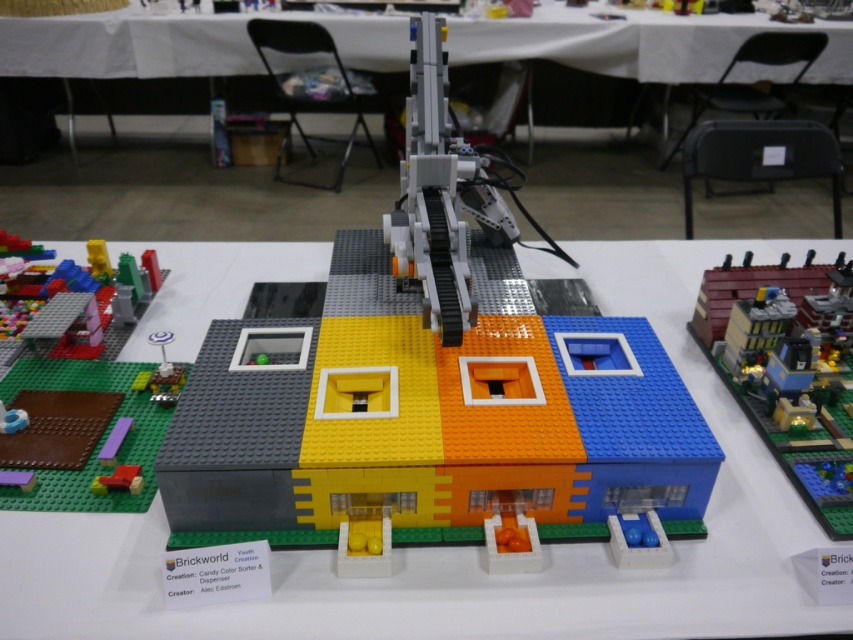
Can you confirm if matte plastic building at center is smaller than brick-colored plastic building at right?

Actually, matte plastic building at center might be larger than brick-colored plastic building at right.

Locate an element on the screen. The height and width of the screenshot is (640, 853). matte plastic building at center is located at coordinates (474, 547).

Between white plastic table at center and brick-colored plastic building at right, which one is positioned higher?

Positioned higher is white plastic table at center.

Who is more distant from viewer, (x=341, y=33) or (x=840, y=269)?

The point (x=341, y=33) is behind.

Where is `white plastic table at center`? white plastic table at center is located at coordinates (178, 44).

Which is in front, point (438, 285) or point (170, 259)?

Positioned in front is point (438, 285).

Who is positioned more to the right, brick-colored plastic building at center or matte plastic building at center?

From the viewer's perspective, matte plastic building at center appears more on the right side.

Which is behind, point (231, 472) or point (412, 632)?

The point (231, 472) is behind.

The width and height of the screenshot is (853, 640). I want to click on brick-colored plastic building at center, so click(432, 394).